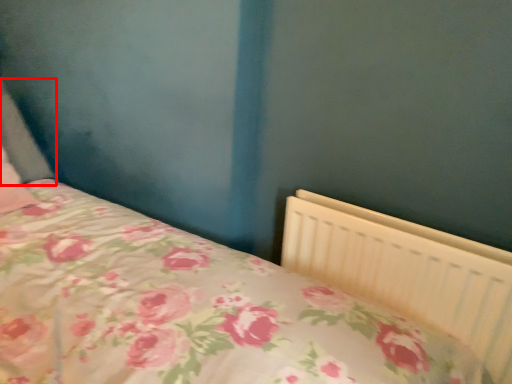
Question: From the image's perspective, what is the correct spatial relationship of pillow (annotated by the red box) in relation to radiator?

Choices:
 (A) above
 (B) below

Answer: (A)